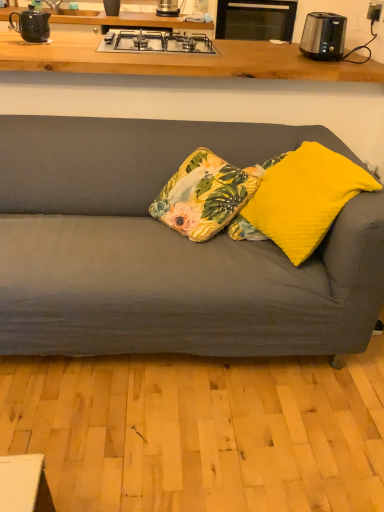
The image size is (384, 512). Identify the location of vacant space that is to the left of polished stainless steel toaster at upper right, placed as the 1th kitchen appliance when sorted from bottom to top. (283, 49).